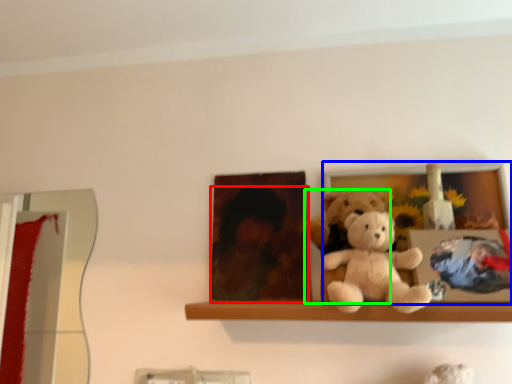
Question: Based on their relative distances, which object is nearer to person (highlighted by a red box)? Choose from picture frame (highlighted by a blue box) and teddy bear (highlighted by a green box).

Choices:
 (A) picture frame
 (B) teddy bear

Answer: (B)